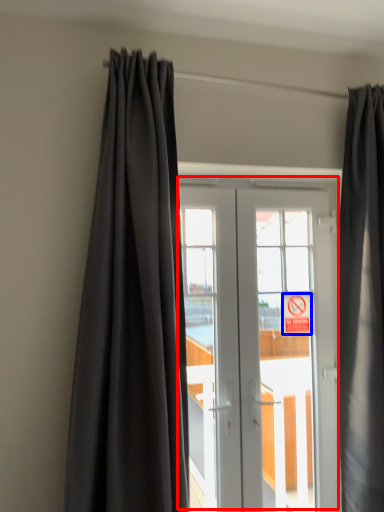
Question: Which object appears closest to the camera in this image, door (highlighted by a red box) or parking sign (highlighted by a blue box)?

Choices:
 (A) door
 (B) parking sign

Answer: (A)